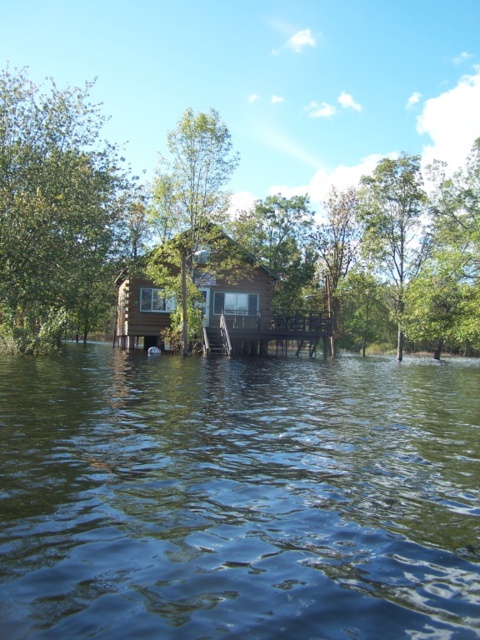
Question: Which of the following is the farthest from the observer?

Choices:
 (A) green leafy tree at upper left
 (B) green matte tree at center
 (C) green leafy tree at upper right

Answer: (C)

Question: Which point is closer to the camera?

Choices:
 (A) green leafy tree at upper left
 (B) green leafy tree at upper right
 (C) green matte tree at center

Answer: (A)

Question: Can you confirm if green matte tree at center is smaller than brown wooden dock at center?

Choices:
 (A) yes
 (B) no

Answer: (B)

Question: Does green water at center have a larger size compared to green matte tree at center?

Choices:
 (A) yes
 (B) no

Answer: (B)

Question: Is green wood tree at center smaller than green leafy tree at upper right?

Choices:
 (A) yes
 (B) no

Answer: (B)

Question: Among these objects, which one is farthest from the camera?

Choices:
 (A) green wood tree at center
 (B) green water at center

Answer: (A)